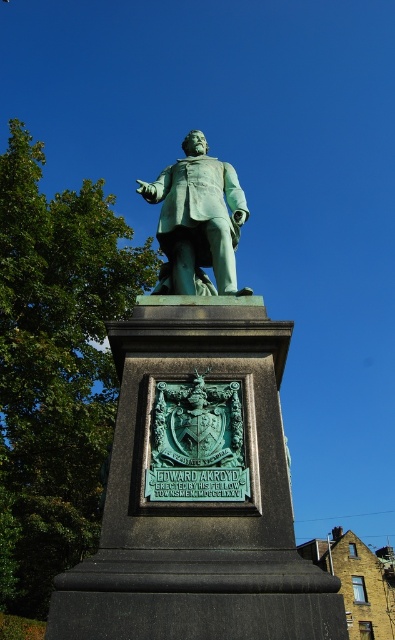
What are the coordinates of the green patina statue at center?

The green patina statue at center is located at coordinates point (197, 454).

You are standing in front of the statue of Edward Akroyd. There are two statues here, the green patina statue at center and the green patinated statue at center. Which one is positioned to the left?

The green patina statue at center is positioned to the left of the green patinated statue at center.